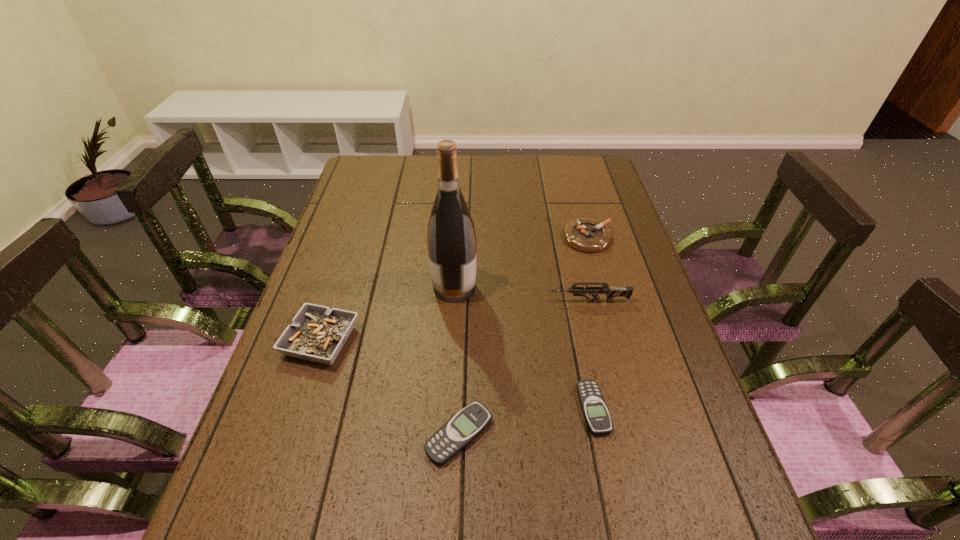
Where is `the second shortest object`? The height and width of the screenshot is (540, 960). the second shortest object is located at coordinates (458, 432).

You are a GUI agent. You are given a task and a screenshot of the screen. Output one action in this format:
    pyautogui.click(x=<x>, y=<y>)
    Task: Click on the left beeper
    
    Given the screenshot: What is the action you would take?
    pyautogui.click(x=458, y=432)

The image size is (960, 540). Find the location of `the right beeper`. the right beeper is located at coordinates (594, 408).

Find the location of a particular element. The height and width of the screenshot is (540, 960). the shortest object is located at coordinates (594, 408).

Where is `wine bottle`? The height and width of the screenshot is (540, 960). wine bottle is located at coordinates (451, 238).

This screenshot has width=960, height=540. I want to click on the farthest object, so click(588, 235).

The height and width of the screenshot is (540, 960). I want to click on the farther ashtray, so click(x=588, y=235).

Locate an element on the screen. Image resolution: width=960 pixels, height=540 pixels. the fifth shortest object is located at coordinates (611, 292).

The height and width of the screenshot is (540, 960). What are the coordinates of `the leftmost object` in the screenshot? It's located at (317, 333).

Find the location of a particular element. The width and height of the screenshot is (960, 540). the third nearest object is located at coordinates (317, 333).